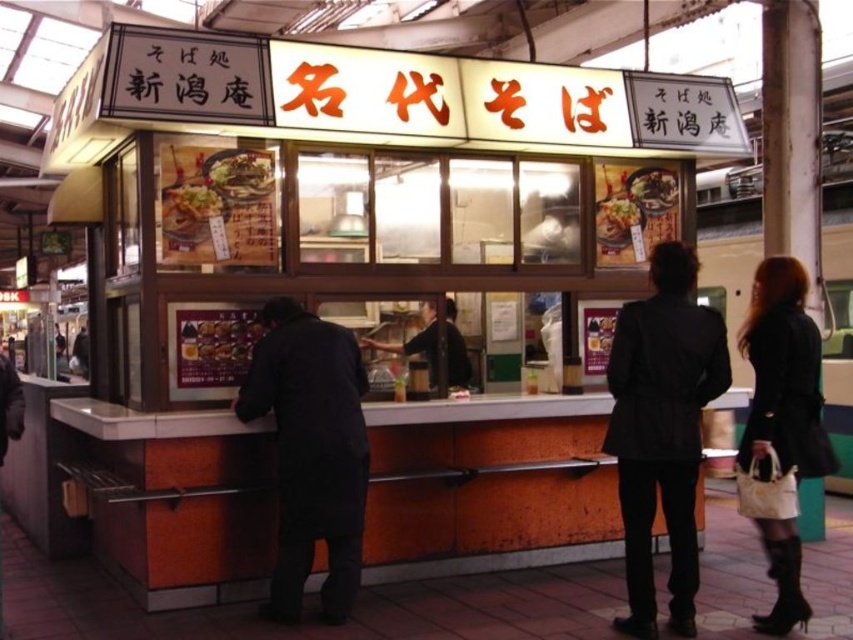
You are a customer at the Nagai Soba stall and want to place an order. You notice a black matte jacket at center and a shiny plastic bowl at center on the counter. Which object is closer to you as you stand in front of the counter?

The black matte jacket at center is positioned under the shiny plastic bowl at center, meaning the shiny plastic bowl at center is closer to you since it is on top.